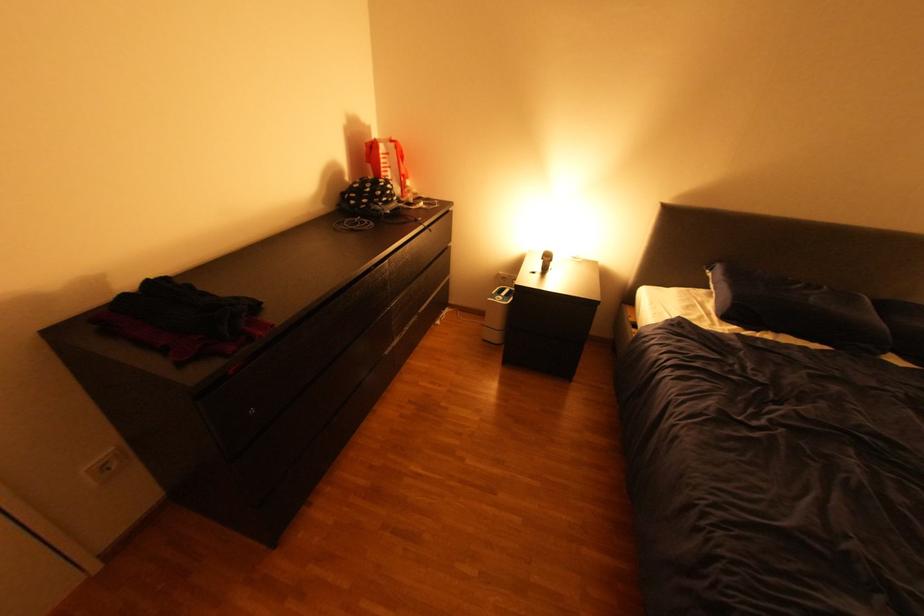
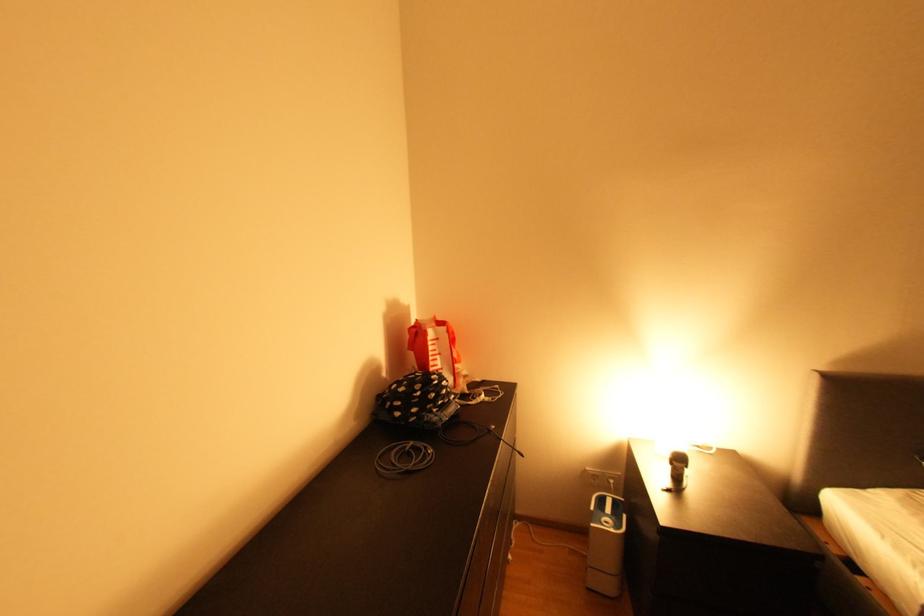
Find the pixel in the second image that matches point 386,204 in the first image.

(441, 411)